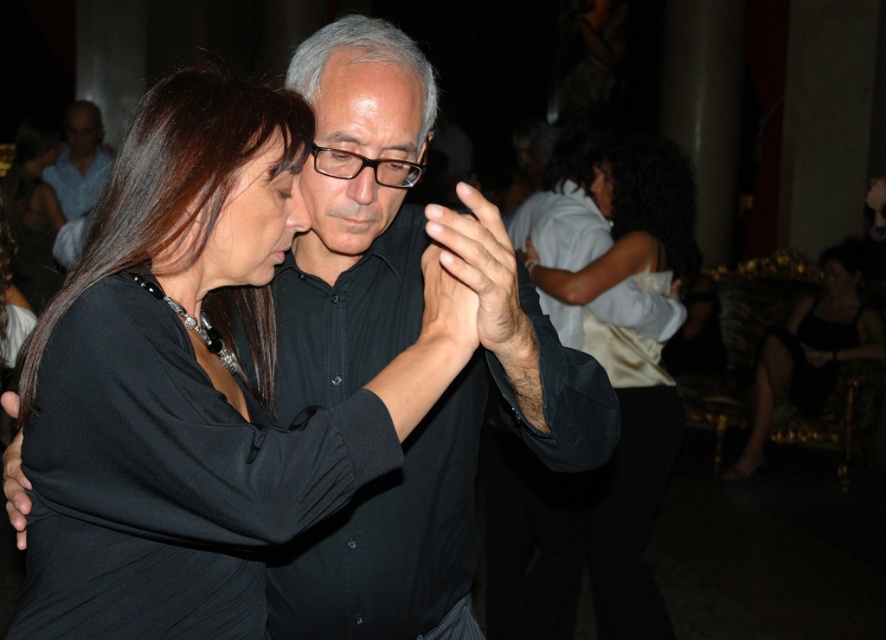
Who is positioned more to the left, black satin blouse at center or white satin dress at center?

black satin blouse at center is more to the left.

Measure the distance between point (329,426) and camera.

1.30 meters

Describe the element at coordinates (208, 188) in the screenshot. I see `black satin blouse at center` at that location.

The image size is (886, 640). Identify the location of black satin blouse at center. (208, 188).

This screenshot has height=640, width=886. Describe the element at coordinates (208, 188) in the screenshot. I see `black satin blouse at center` at that location.

Is point (123, 168) less distant than point (392, 173)?

Yes, it is in front of point (392, 173).

This screenshot has width=886, height=640. I want to click on black satin blouse at center, so click(x=208, y=188).

Who is positioned more to the right, matte black forehead at center or black plastic glasses at center?

Positioned to the right is matte black forehead at center.

Which is below, matte black forehead at center or black plastic glasses at center?

black plastic glasses at center

What do you see at coordinates (369, 106) in the screenshot?
I see `matte black forehead at center` at bounding box center [369, 106].

Identify the location of matte black forehead at center. This screenshot has width=886, height=640. (369, 106).